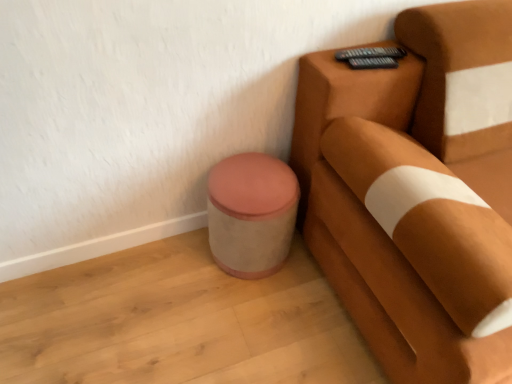
Question: Can you confirm if suede brown armchair at right is positioned to the left of pink fabric ottoman at lower left?

Choices:
 (A) no
 (B) yes

Answer: (A)

Question: From the image's perspective, is suede brown armchair at right on pink fabric ottoman at lower left?

Choices:
 (A) yes
 (B) no

Answer: (A)

Question: Is suede brown armchair at right thinner than pink fabric ottoman at lower left?

Choices:
 (A) yes
 (B) no

Answer: (B)

Question: Is suede brown armchair at right outside pink fabric ottoman at lower left?

Choices:
 (A) no
 (B) yes

Answer: (B)

Question: From the image's perspective, is suede brown armchair at right located beneath pink fabric ottoman at lower left?

Choices:
 (A) no
 (B) yes

Answer: (A)

Question: Does suede brown armchair at right have a smaller size compared to pink fabric ottoman at lower left?

Choices:
 (A) yes
 (B) no

Answer: (B)

Question: From a real-world perspective, is pink fabric ottoman at lower left on top of suede brown armchair at right?

Choices:
 (A) no
 (B) yes

Answer: (A)

Question: Is pink fabric ottoman at lower left positioned beyond the bounds of suede brown armchair at right?

Choices:
 (A) yes
 (B) no

Answer: (A)

Question: Considering the relative positions of pink fabric ottoman at lower left and suede brown armchair at right in the image provided, is pink fabric ottoman at lower left to the right of suede brown armchair at right from the viewer's perspective?

Choices:
 (A) yes
 (B) no

Answer: (B)

Question: Does pink fabric ottoman at lower left have a lesser height compared to suede brown armchair at right?

Choices:
 (A) yes
 (B) no

Answer: (A)

Question: Can you confirm if pink fabric ottoman at lower left is bigger than suede brown armchair at right?

Choices:
 (A) yes
 (B) no

Answer: (B)

Question: Is suede brown armchair at right inside pink fabric ottoman at lower left?

Choices:
 (A) no
 (B) yes

Answer: (A)

Question: In terms of width, does pink fabric ottoman at lower left look wider or thinner when compared to suede brown armchair at right?

Choices:
 (A) thin
 (B) wide

Answer: (A)